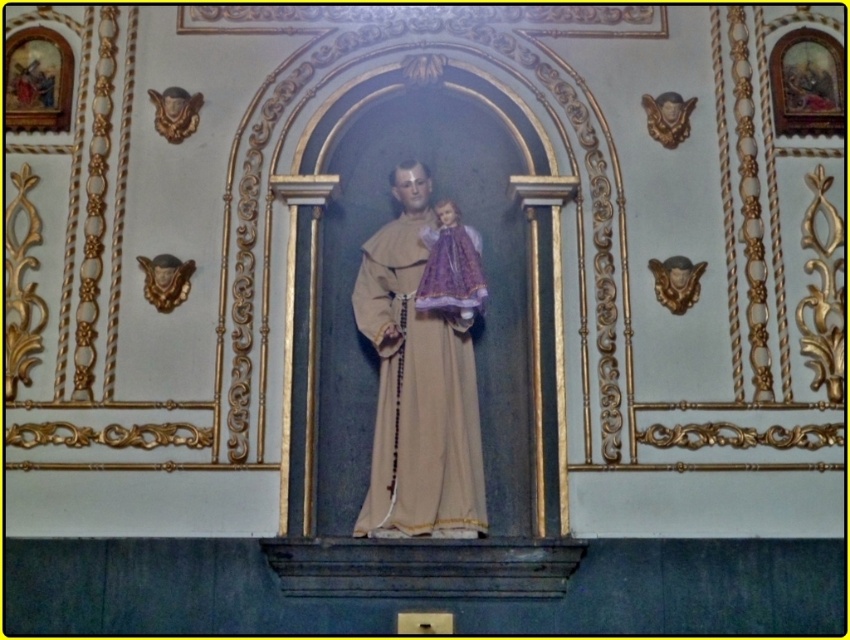
Which is in front, point (446, 429) or point (425, 307)?

Positioned in front is point (446, 429).

Is point (422, 508) positioned in front of point (448, 230)?

Yes, point (422, 508) is in front of point (448, 230).

Find the location of `matte gold statue at center`. matte gold statue at center is located at coordinates (416, 387).